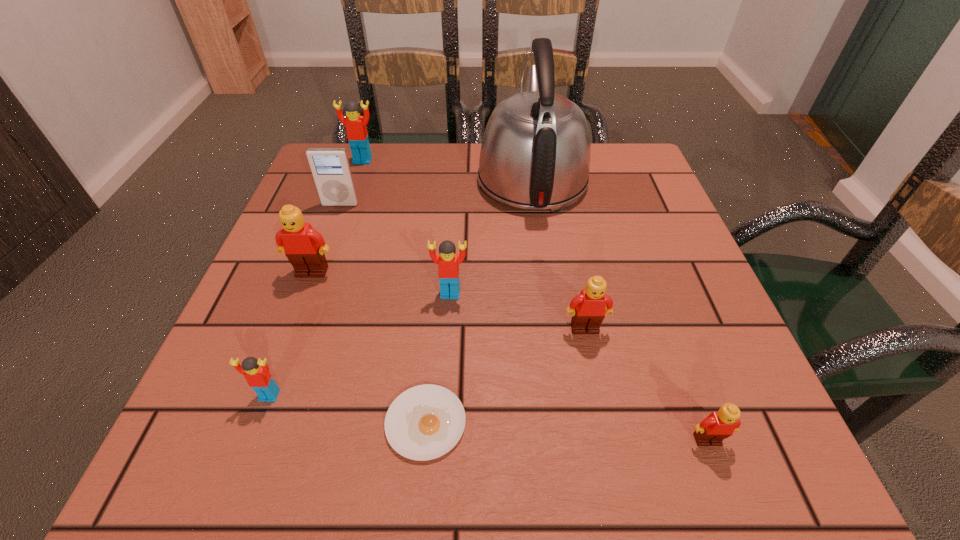
Locate an element on the screen. This screenshot has height=540, width=960. the fifth Lego from left to right is located at coordinates tap(589, 308).

You are a GUI agent. You are given a task and a screenshot of the screen. Output one action in this format:
    pyautogui.click(x=<x>, y=<y>)
    Task: Click on the nearest red Lego
    
    Given the screenshot: What is the action you would take?
    pyautogui.click(x=256, y=372)

You are a GUI agent. You are given a task and a screenshot of the screen. Output one action in this format:
    pyautogui.click(x=<x>, y=<y>)
    Task: Click on the smallest red Lego
    The width and height of the screenshot is (960, 540).
    Given the screenshot: What is the action you would take?
    pyautogui.click(x=256, y=372)

At what (x,y) coordinates should I click in order to perform the action: click on the nearest Lego. Please return your answer as a coordinate pair (x, y). This screenshot has height=540, width=960. Looking at the image, I should click on (719, 425).

Find the location of a particular element. The image size is (960, 540). the smallest brown Lego is located at coordinates (x=719, y=425).

I want to click on white egg yolk, so click(424, 422).

You are a GUI agent. You are given a task and a screenshot of the screen. Output one action in this format:
    pyautogui.click(x=<x>, y=<y>)
    Task: Click on the egg yolk
    Image resolution: width=960 pixels, height=540 pixels.
    Given the screenshot: What is the action you would take?
    pyautogui.click(x=424, y=422)

Where is `free location located 0.340m on the face of the farthest Lego`? This screenshot has height=540, width=960. free location located 0.340m on the face of the farthest Lego is located at coordinates (328, 260).

Where is `blank space located on the face of the sixth nearest object`? The width and height of the screenshot is (960, 540). blank space located on the face of the sixth nearest object is located at coordinates (293, 322).

Where is `free space located on the front-facing side of the iPod`? free space located on the front-facing side of the iPod is located at coordinates (331, 231).